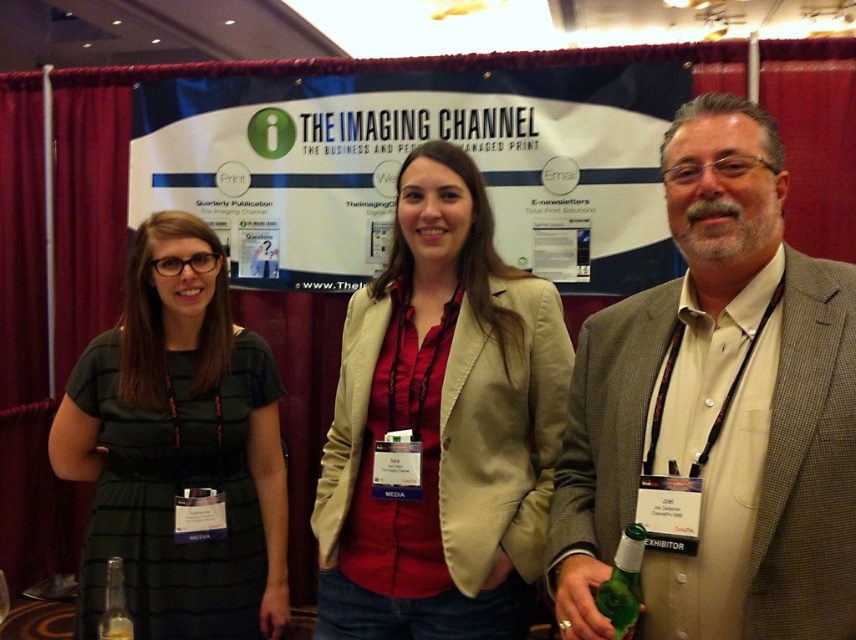
You are attending a conference and see the dark green dress at left and the green glass bottle at lower right. Which object is positioned more to the left side of the scene?

The dark green dress at left is positioned more to the left side of the scene than the green glass bottle at lower right.

You are a photographer at the event and need to capture a photo of the beige fabric blazer at center and the green glass bottle at lower right. The minimum focus distance for your camera is 50 centimeters. Will you be able to focus on both objects if they are placed at their current positions?

The distance between the beige fabric blazer at center and the green glass bottle at lower right is 57.76 centimeters, which is greater than the camera minimum focus distance of 50 centimeters. Therefore, the camera can focus on both objects at their current positions.

You are an event photographer at this conference. You need to capture a photo where the dark green dress at left and the green glass bottle at lower right are both visible. Considering their sizes, which object should you ensure is closer to the camera to avoid being too small in the frame?

The green glass bottle at lower right is smaller than the dark green dress at left. To ensure it isn not too small in the frame, you should position the green glass bottle at lower right closer to the camera.